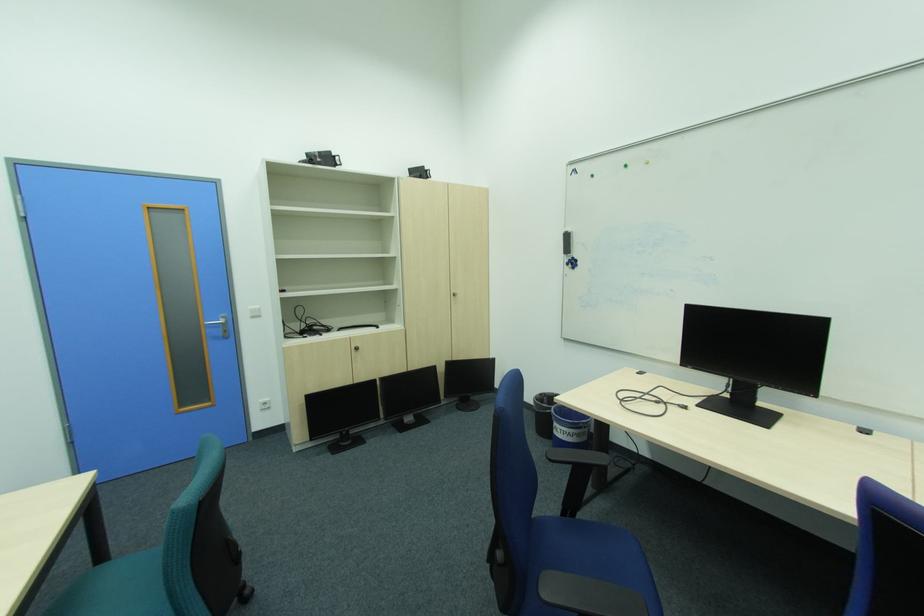
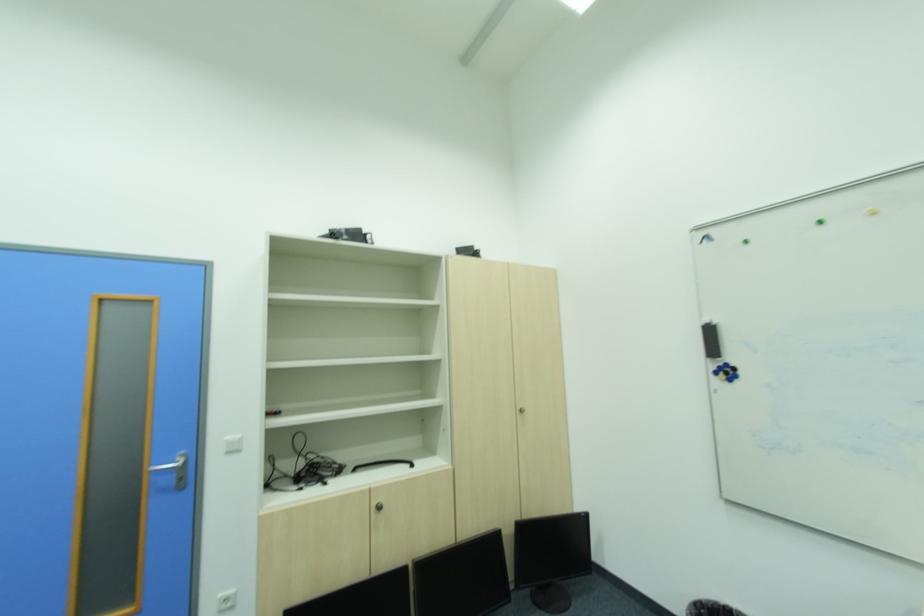
Question: I am providing you with two images of the same scene from different viewpoints. Which of the following objects are not visible in image2?

Choices:
 (A) black whiteboard eraser
 (B) green magnet
 (C) yellow magnet
 (D) none of these

Answer: (D)